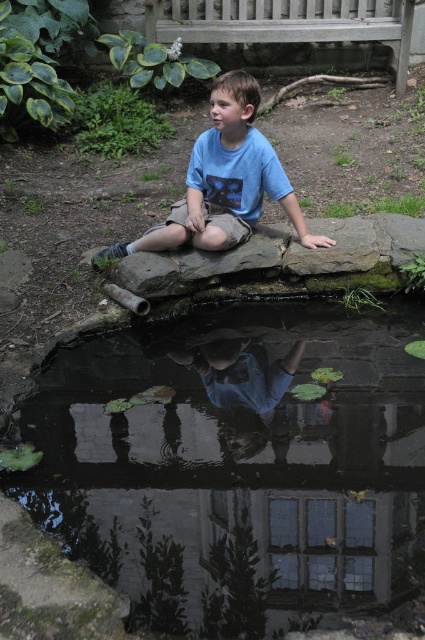
Question: Which point is farther to the camera?

Choices:
 (A) (240, 19)
 (B) (212, 248)
 (C) (278, 339)

Answer: (A)

Question: Which object appears closest to the camera in this image?

Choices:
 (A) blue cotton shirt at center
 (B) wooden bench at upper center
 (C) transparent water at center

Answer: (C)

Question: Where is transparent water at center located in relation to blue cotton shirt at center in the image?

Choices:
 (A) right
 (B) left

Answer: (B)

Question: Does transparent water at center have a lesser width compared to wooden bench at upper center?

Choices:
 (A) no
 (B) yes

Answer: (B)

Question: Does blue cotton shirt at center have a smaller size compared to wooden bench at upper center?

Choices:
 (A) yes
 (B) no

Answer: (A)

Question: Which of the following is the closest to the observer?

Choices:
 (A) transparent water at center
 (B) blue cotton shirt at center

Answer: (A)